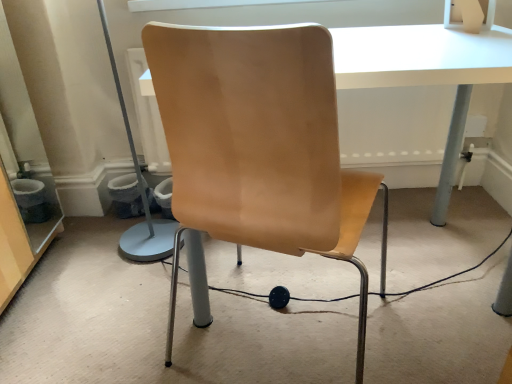
At what (x,y) coordinates should I click in order to perform the action: click on vacant point above white glossy table at center (from a real-world perspective). Please return your answer as a coordinate pair (x, y). The image size is (512, 384). Looking at the image, I should click on (398, 44).